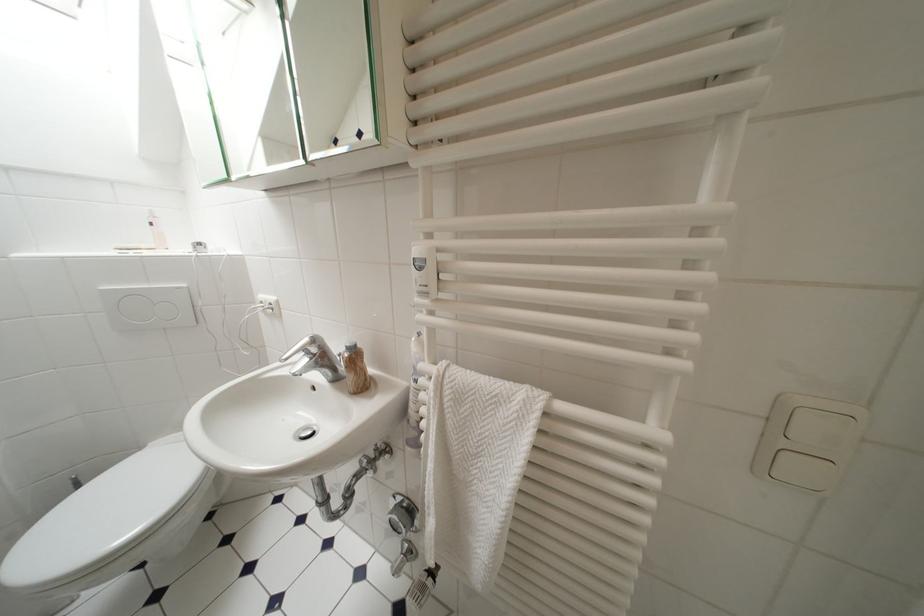
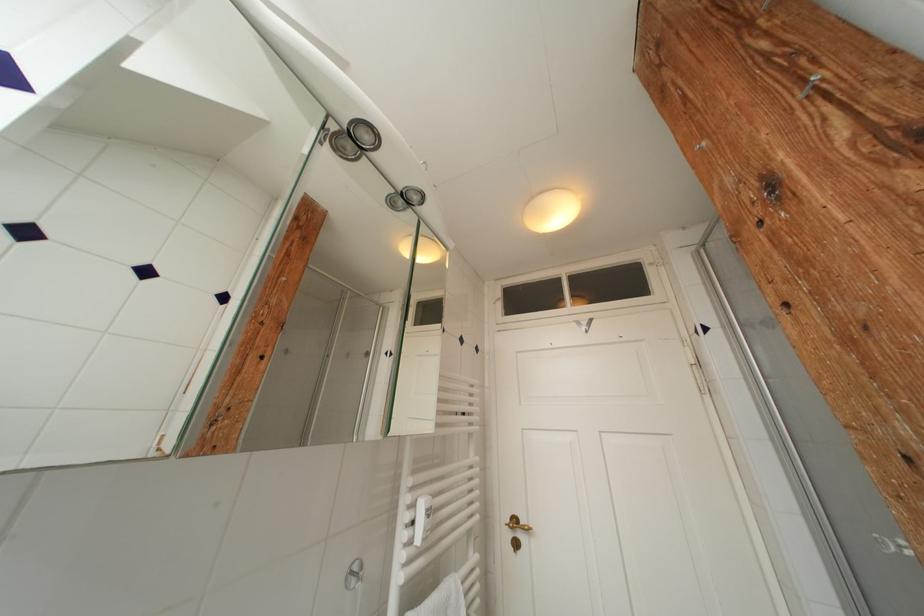
The images are taken continuously from a first-person perspective. In which direction is your viewpoint rotating?

The camera's rotation is toward right-up.